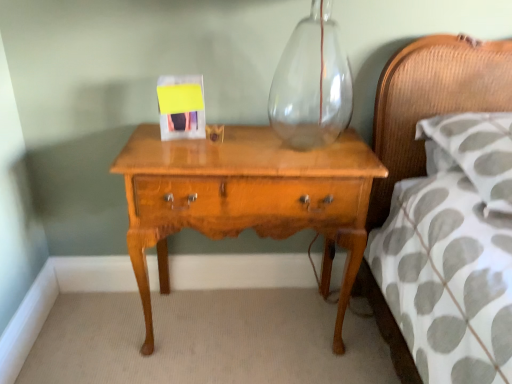
Locate an element on the screen. The height and width of the screenshot is (384, 512). free point above light brown wood nightstand at center (from a real-world perspective) is located at coordinates coord(274,140).